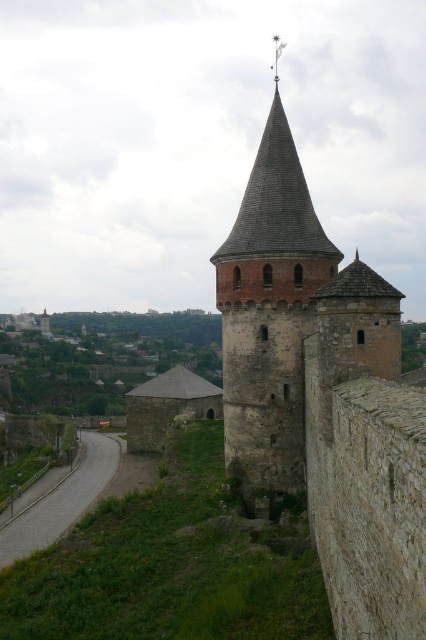
Question: Is rustic stone tower at center positioned before green grassy hillside at upper center?

Choices:
 (A) yes
 (B) no

Answer: (A)

Question: Which point is closer to the camera taking this photo?

Choices:
 (A) (229, 358)
 (B) (123, 323)

Answer: (A)

Question: Which object appears farthest from the camera in this image?

Choices:
 (A) green grassy hillside at upper center
 (B) rustic stone tower at center

Answer: (A)

Question: Is rustic stone tower at center bigger than green grassy hillside at upper center?

Choices:
 (A) yes
 (B) no

Answer: (B)

Question: Among these points, which one is farthest from the camera?

Choices:
 (A) (48, 390)
 (B) (242, 452)

Answer: (A)

Question: Is rustic stone tower at center further to the viewer compared to green grassy hillside at upper center?

Choices:
 (A) no
 (B) yes

Answer: (A)